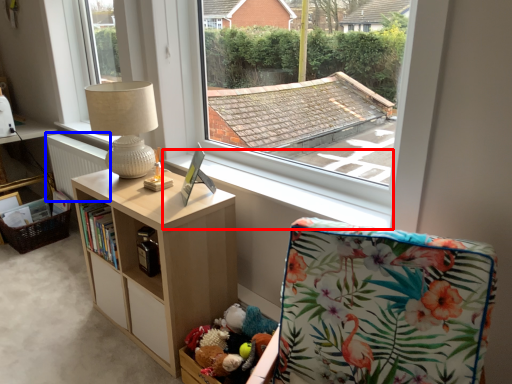
Question: Which point is closer to the camera, window sill (highlighted by a red box) or radiator (highlighted by a blue box)?

Choices:
 (A) window sill
 (B) radiator

Answer: (A)